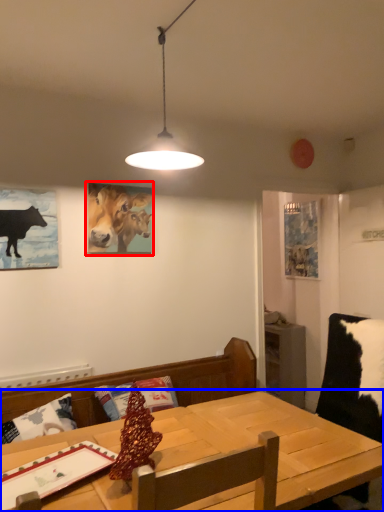
Question: Which object appears closest to the camera in this image, picture frame (highlighted by a red box) or table (highlighted by a blue box)?

Choices:
 (A) picture frame
 (B) table

Answer: (B)